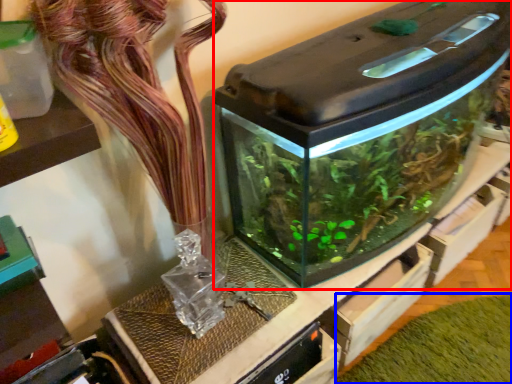
Question: Which object is further to the camera taking this photo, water tank (highlighted by a red box) or plant (highlighted by a blue box)?

Choices:
 (A) water tank
 (B) plant

Answer: (B)